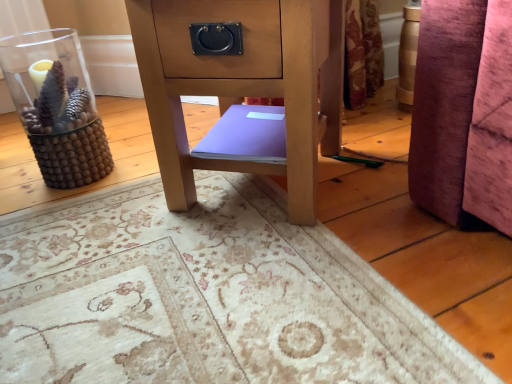
I want to click on purple matte book at center, so click(x=246, y=135).

Where is `transparent glass vase at left`? transparent glass vase at left is located at coordinates (56, 106).

In the scene shown: How many degrees apart are the facing directions of transparent glass vase at left and purple matte book at center?

The angle between the facing direction of transparent glass vase at left and the facing direction of purple matte book at center is 39.5 degrees.

Which point is more distant from viewer, (113, 166) or (251, 109)?

The point (113, 166) is farther from the camera.

From the picture: Considering their positions, is transparent glass vase at left located in front of or behind purple matte book at center?

transparent glass vase at left is positioned farther from the viewer than purple matte book at center.

Consider the image. Does transparent glass vase at left have a lesser height compared to purple matte book at center?

No.

In the image, is matte wood side table at center on the left side or the right side of transparent glass vase at left?

Based on their positions, matte wood side table at center is located to the right of transparent glass vase at left.

How much distance is there between matte wood side table at center and transparent glass vase at left?

matte wood side table at center is 35.93 inches from transparent glass vase at left.

From the image's perspective, between matte wood side table at center and transparent glass vase at left, which one is located above?

matte wood side table at center.

How many degrees apart are the facing directions of purple matte book at center and transparent glass vase at left?

39.5 degrees separate the facing orientations of purple matte book at center and transparent glass vase at left.

From the image's perspective, is purple matte book at center located above or below transparent glass vase at left?

Clearly, from the image's perspective, purple matte book at center is below transparent glass vase at left.

Is purple matte book at center further to camera compared to transparent glass vase at left?

No, the depth of purple matte book at center is less than that of transparent glass vase at left.

Looking at this image, from a real-world perspective, is purple matte book at center located higher than transparent glass vase at left?

No.

In the image, is purple matte book at center positioned in front of or behind matte wood side table at center?

purple matte book at center is behind matte wood side table at center.

Which is behind, point (234, 134) or point (197, 73)?

Point (234, 134)

Who is shorter, purple matte book at center or matte wood side table at center?

purple matte book at center is shorter.

Looking at this image, can you tell me how much transparent glass vase at left and matte wood side table at center differ in facing direction?

44 degrees separate the facing orientations of transparent glass vase at left and matte wood side table at center.

Identify the location of furniture in front of the transparent glass vase at left. (244, 91).

From the image's perspective, which object appears higher, transparent glass vase at left or matte wood side table at center?

matte wood side table at center.

Can you confirm if transparent glass vase at left is wider than matte wood side table at center?

In fact, transparent glass vase at left might be narrower than matte wood side table at center.

Is matte wood side table at center far away from purple matte book at center?

No, matte wood side table at center is not far away from purple matte book at center.

How much distance is there between matte wood side table at center and purple matte book at center?

The distance of matte wood side table at center from purple matte book at center is 3.42 inches.

From a real-world perspective, is matte wood side table at center located higher than purple matte book at center?

Correct, in the physical world, matte wood side table at center is higher than purple matte book at center.

Consider the image. Which of these two, matte wood side table at center or purple matte book at center, is thinner?

With smaller width is purple matte book at center.

Find the location of a particular element. book directly beneath the transparent glass vase at left (from a real-world perspective) is located at coordinates (246, 135).

I want to click on furniture in front of the transparent glass vase at left, so click(244, 91).

Considering their positions, is transparent glass vase at left positioned closer to matte wood side table at center than purple matte book at center?

Among the two, purple matte book at center is located nearer to matte wood side table at center.

Which object lies further to the anchor point matte wood side table at center, purple matte book at center or transparent glass vase at left?

transparent glass vase at left is positioned further to the anchor matte wood side table at center.

Based on their spatial positions, is matte wood side table at center or transparent glass vase at left further from purple matte book at center?

transparent glass vase at left is positioned further to the anchor purple matte book at center.

Looking at the image, which one is located closer to purple matte book at center, transparent glass vase at left or matte wood side table at center?

Among the two, matte wood side table at center is located nearer to purple matte book at center.

Estimate the real-world distances between objects in this image. Which object is further from transparent glass vase at left, matte wood side table at center or purple matte book at center?

matte wood side table at center is positioned further to the anchor transparent glass vase at left.

Based on their spatial positions, is purple matte book at center or matte wood side table at center closer to transparent glass vase at left?

The object closer to transparent glass vase at left is purple matte book at center.

Identify the location of book between transparent glass vase at left and matte wood side table at center. (246, 135).